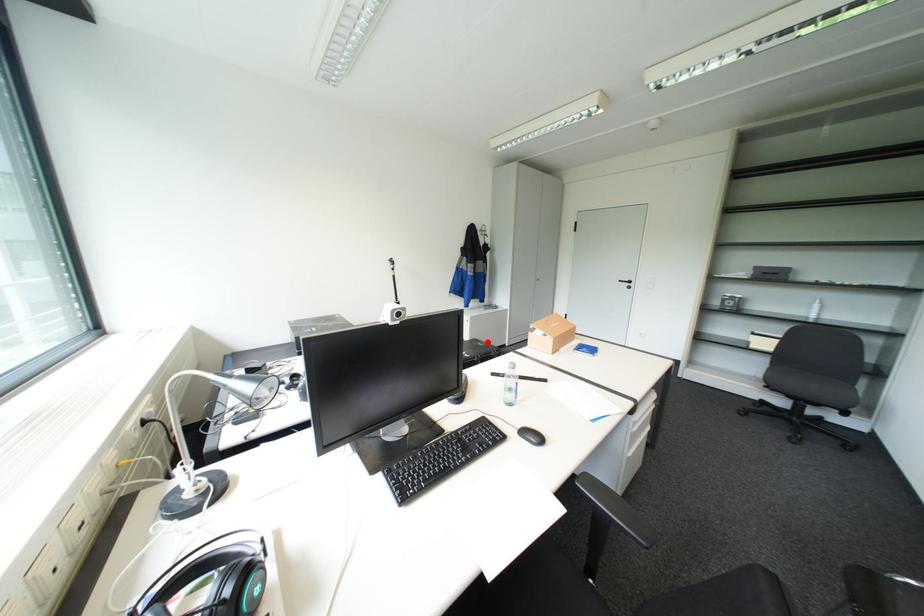
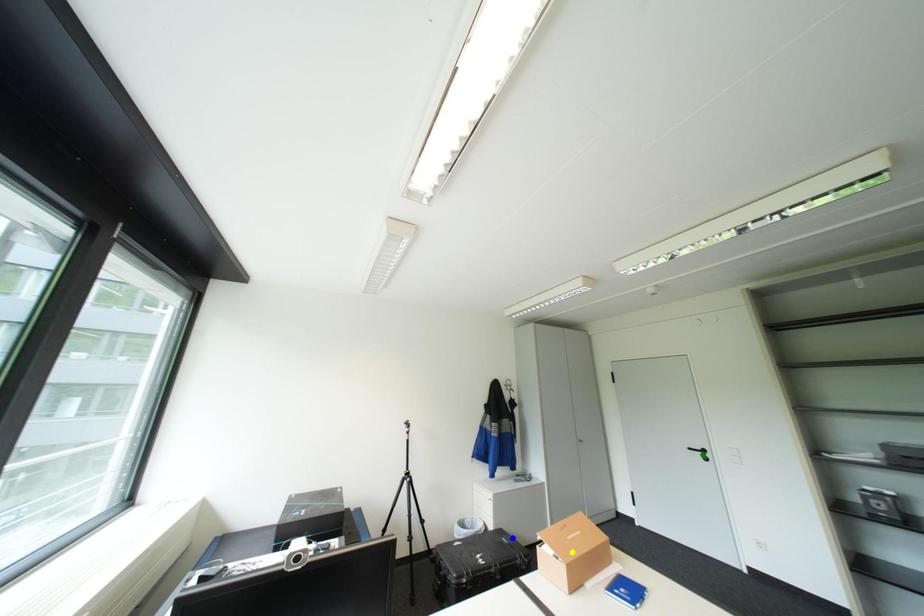
Question: I am providing you with two images of the same scene from different viewpoints. A red point is marked on the first image. You are given multiple points on the second image. Which mark in image 2 goes with the point in image 1?

Choices:
 (A) green point
 (B) yellow point
 (C) blue point

Answer: (C)